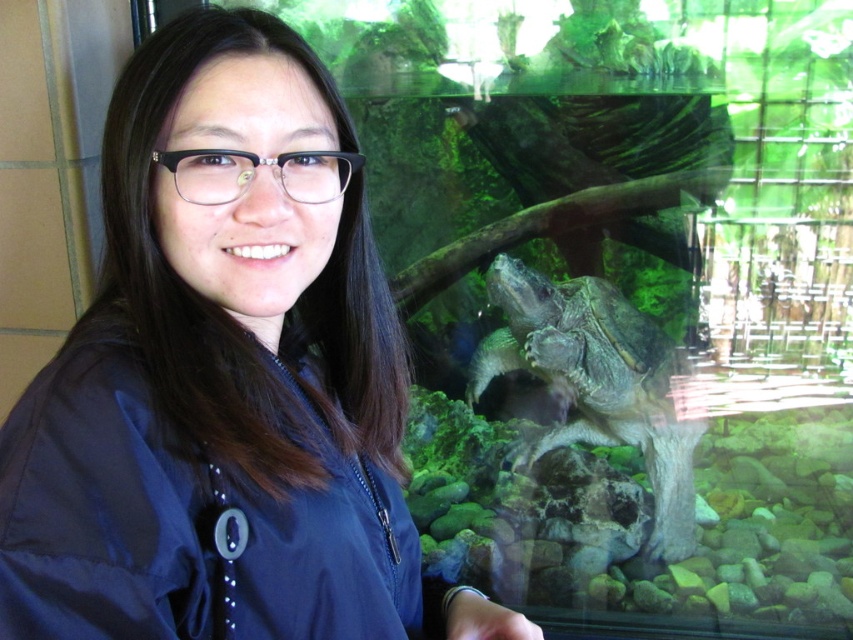
Question: Among these points, which one is farthest from the camera?

Choices:
 (A) (198, 177)
 (B) (621, 436)

Answer: (B)

Question: Is blue fabric at center positioned in front of smooth gray tortoise at center?

Choices:
 (A) yes
 (B) no

Answer: (A)

Question: Which of the following is the farthest from the observer?

Choices:
 (A) (193, 250)
 (B) (686, 525)

Answer: (B)

Question: Can you confirm if blue fabric at center is positioned to the left of smooth gray tortoise at center?

Choices:
 (A) yes
 (B) no

Answer: (A)

Question: Is blue fabric at center to the left of smooth gray tortoise at center from the viewer's perspective?

Choices:
 (A) no
 (B) yes

Answer: (B)

Question: Which of the following is the closest to the observer?

Choices:
 (A) blue fabric at center
 (B) smooth gray tortoise at center

Answer: (A)